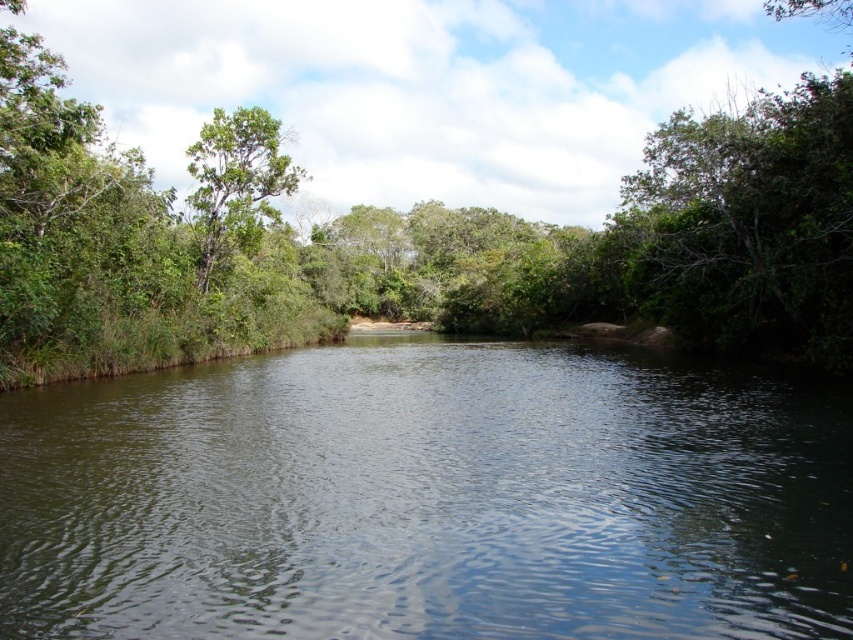
You are standing at the edge of the river and want to take a photo of the dark green water at center and the green leafy tree at upper left. Which object is closer to the camera based on their positions?

The dark green water at center is positioned under green leafy tree at upper left, so the dark green water at center is closer to the camera than the tree.

You are a boat operator planning to navigate a boat through the river shown in the image. The boat requires a minimum of 50 meters of clearance between obstacles to safely pass. Given the distance between the dark green water at center and the green leafy tree at center, can your boat safely navigate this section of the river?

The dark green water at center and green leafy tree at center are 60.33 meters apart, which exceeds the boat operator requires a minimum of 50 meters of clearance between obstacles to safely pass. Therefore, the boat can safely navigate this section of the river.